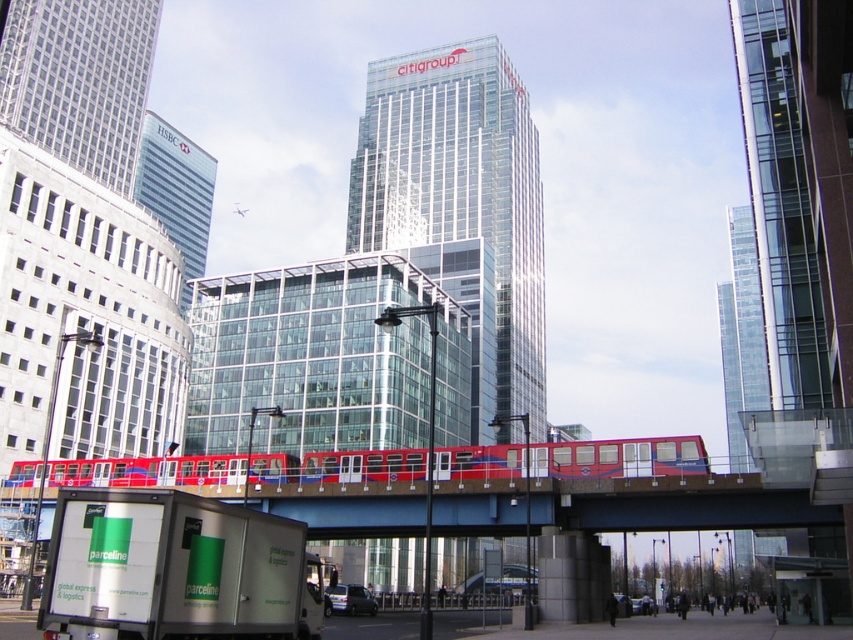
Does white matte truck at lower left appear on the left side of red metallic train at center?

Indeed, white matte truck at lower left is positioned on the left side of red metallic train at center.

Is point (177, 625) positioned in front of point (126, 458)?

Yes, it is in front of point (126, 458).

Identify the location of white matte truck at lower left. Image resolution: width=853 pixels, height=640 pixels. (175, 570).